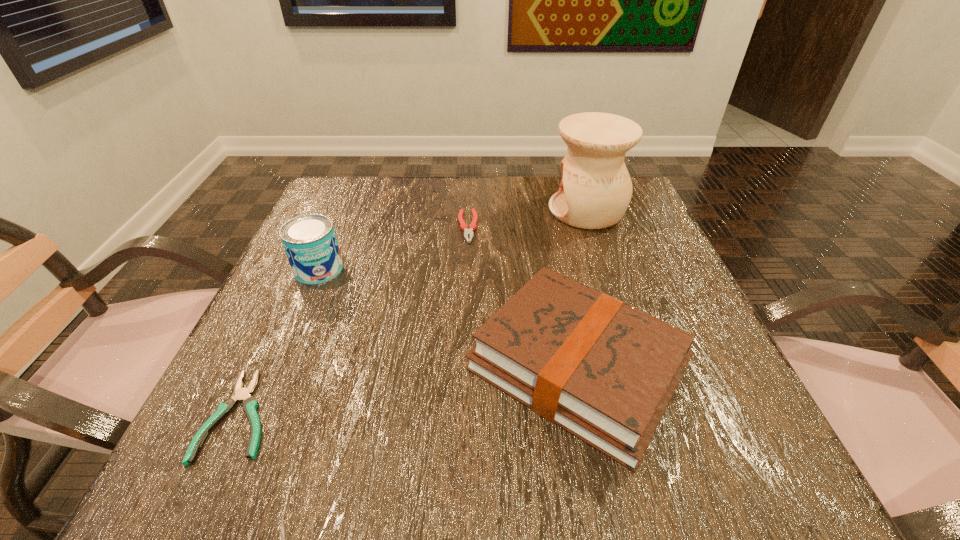
At what (x,y) coordinates should I click in order to perform the action: click on the tallest object. Please return your answer as a coordinate pair (x, y). Looking at the image, I should click on (595, 190).

You are a GUI agent. You are given a task and a screenshot of the screen. Output one action in this format:
    pyautogui.click(x=<x>, y=<y>)
    Task: Click on the third farthest object
    Image resolution: width=960 pixels, height=540 pixels.
    Given the screenshot: What is the action you would take?
    pyautogui.click(x=310, y=243)

What are the coordinates of `the fourth shortest object` in the screenshot? It's located at (310, 243).

Find the location of a particular element. The image size is (960, 540). hardback book is located at coordinates (604, 371).

Find the location of a particular element. The image size is (960, 540). the farther pliers is located at coordinates (467, 232).

Locate an element on the screen. This screenshot has width=960, height=540. the right pliers is located at coordinates (467, 232).

Locate an element on the screen. Image resolution: width=960 pixels, height=540 pixels. the shortest object is located at coordinates (249, 403).

You are a GUI agent. You are given a task and a screenshot of the screen. Output one action in this format:
    pyautogui.click(x=<x>, y=<y>)
    Task: Click on the shorter pliers
    
    Given the screenshot: What is the action you would take?
    pyautogui.click(x=249, y=403)

Find the location of `free space located 0.380m at the open side of the tallest object`. free space located 0.380m at the open side of the tallest object is located at coordinates (391, 210).

At what (x,y) coordinates should I click in order to perform the action: click on free space located at the open side of the tallest object. Please return your answer as a coordinate pair (x, y). Image resolution: width=960 pixels, height=540 pixels. Looking at the image, I should click on (482, 210).